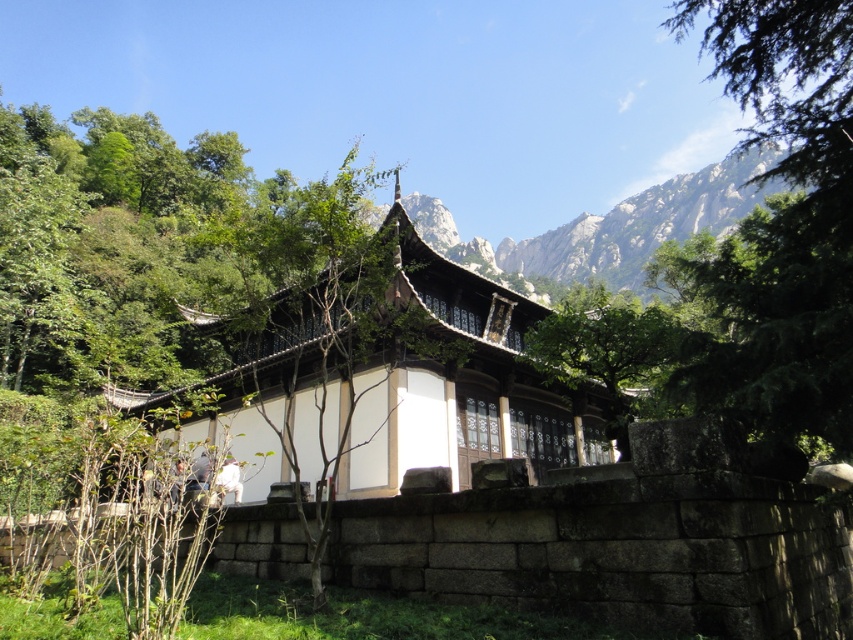
Question: Which point is closer to the camera?

Choices:
 (A) gray rocky mountain at upper center
 (B) green leafy tree at upper right

Answer: (B)

Question: In this image, where is green leafy tree at upper right located relative to gray rocky mountain at upper center?

Choices:
 (A) below
 (B) above

Answer: (B)

Question: Can you confirm if green leafy tree at upper right is wider than gray rocky mountain at upper center?

Choices:
 (A) yes
 (B) no

Answer: (B)

Question: Is green leafy tree at upper right thinner than gray rocky mountain at upper center?

Choices:
 (A) yes
 (B) no

Answer: (A)

Question: Which object is farther from the camera taking this photo?

Choices:
 (A) green leafy tree at upper right
 (B) gray rocky mountain at upper center

Answer: (B)